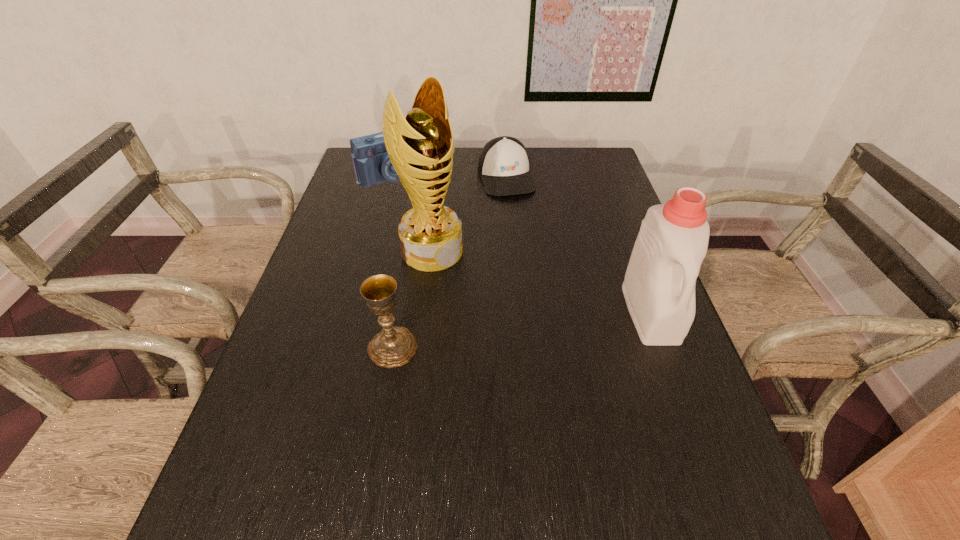
Identify the location of camera present at the far edge. Image resolution: width=960 pixels, height=540 pixels. (372, 166).

You are a GUI agent. You are given a task and a screenshot of the screen. Output one action in this format:
    pyautogui.click(x=<x>, y=<y>)
    Task: Click on the object at the left edge
    The height and width of the screenshot is (540, 960).
    Given the screenshot: What is the action you would take?
    pyautogui.click(x=372, y=166)

Where is `object present at the right edge`? The width and height of the screenshot is (960, 540). object present at the right edge is located at coordinates (659, 286).

You are a GUI agent. You are given a task and a screenshot of the screen. Output one action in this format:
    pyautogui.click(x=<x>, y=<y>)
    Task: Click on the object situated at the far left corner
    The width and height of the screenshot is (960, 540).
    Given the screenshot: What is the action you would take?
    pyautogui.click(x=372, y=166)

In order to click on vacant space at the near edge of the desktop in this screenshot , I will do `click(432, 472)`.

Identify the location of vacant area at the left edge. The height and width of the screenshot is (540, 960). (329, 272).

In order to click on free region at the right edge of the desktop in this screenshot , I will do `click(582, 224)`.

The height and width of the screenshot is (540, 960). I want to click on vacant position at the near left corner of the desktop, so click(315, 468).

What are the coordinates of `vacant space at the far right corner of the desktop` in the screenshot? It's located at (572, 182).

This screenshot has height=540, width=960. I want to click on vacant space that is in between the award and the third shortest object, so click(413, 299).